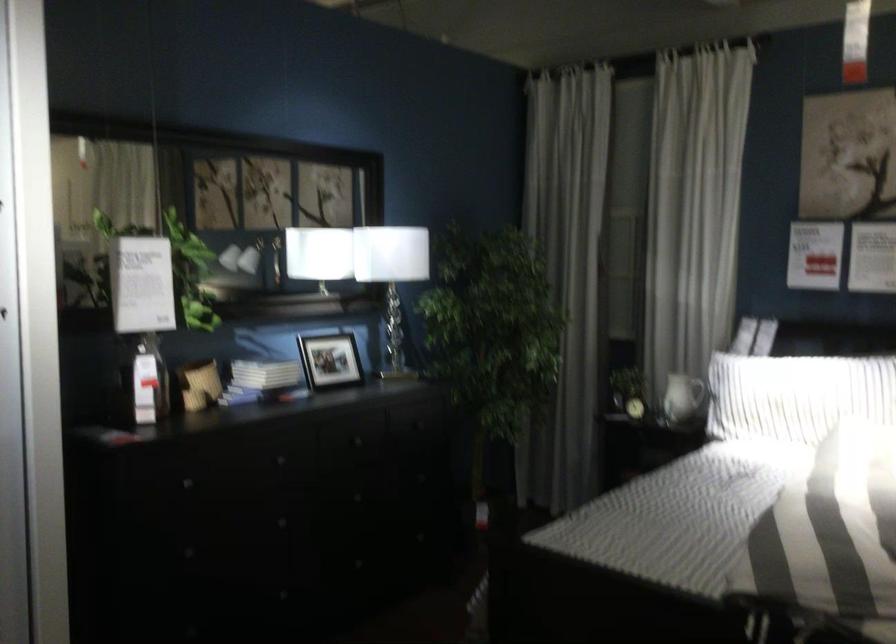
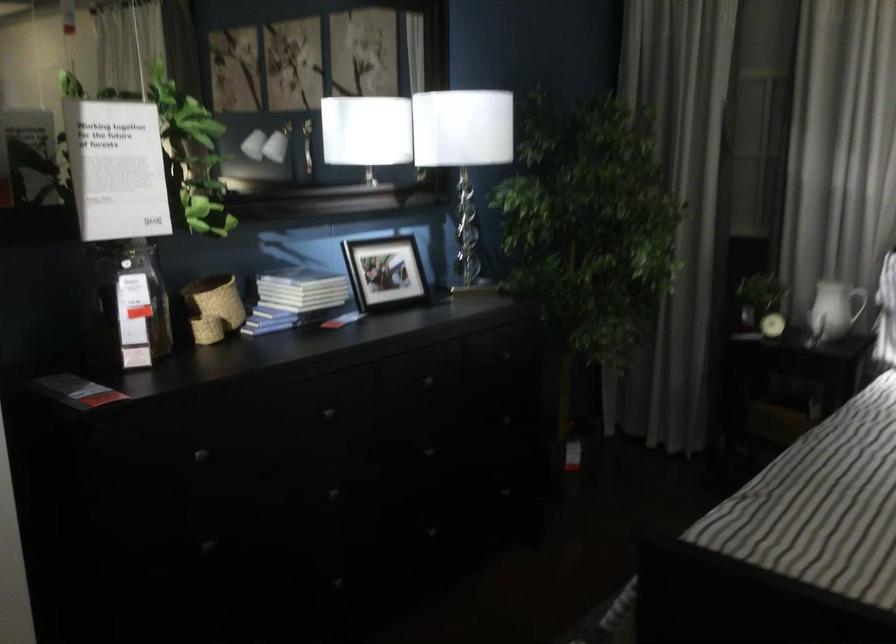
The point at (x=199, y=384) is marked in the first image. Where is the corresponding point in the second image?

(213, 307)